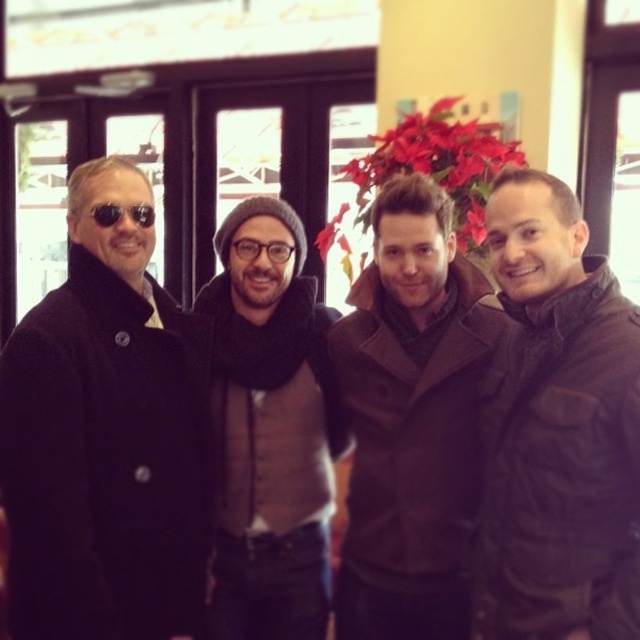
Question: Does brown quilted jacket at right appear under brown wool coat at center?

Choices:
 (A) yes
 (B) no

Answer: (B)

Question: Which point is farther to the camera?

Choices:
 (A) brown quilted jacket at right
 (B) black wool coat at left

Answer: (B)

Question: Which point appears farthest from the camera in this image?

Choices:
 (A) (349, 282)
 (B) (108, 205)
 (C) (609, 593)

Answer: (A)

Question: Is brown wool coat at center smaller than black matte sunglasses at left?

Choices:
 (A) no
 (B) yes

Answer: (A)

Question: Does red velvet poinsettia at center appear over black matte sunglasses at left?

Choices:
 (A) yes
 (B) no

Answer: (A)

Question: Which object is the closest to the brown wool coat at center?

Choices:
 (A) matte black glasses at center
 (B) black matte sunglasses at left

Answer: (A)